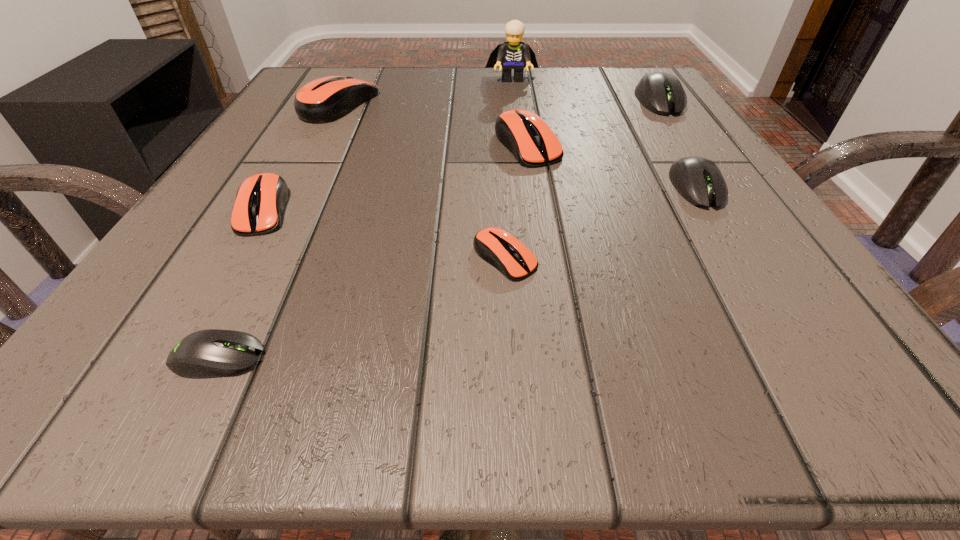
Find the location of a particular element. The width and height of the screenshot is (960, 540). Lego is located at coordinates (514, 54).

The height and width of the screenshot is (540, 960). Find the location of `the tallest object`. the tallest object is located at coordinates [514, 54].

Find the location of `the biggest orange computer mouse`. the biggest orange computer mouse is located at coordinates (324, 100).

Identify the location of the biggest gray computer mouse. The image size is (960, 540). (661, 93).

In order to click on the second biggest orange computer mouse in this screenshot , I will do [x=526, y=135].

This screenshot has height=540, width=960. Identify the location of the second biggest gray computer mouse. (698, 180).

Where is `the second smallest orange computer mouse`? the second smallest orange computer mouse is located at coordinates (260, 200).

This screenshot has height=540, width=960. What are the coordinates of `the nearest computer mouse` in the screenshot? It's located at (212, 353).

Identify the location of the smallest gray computer mouse. (212, 353).

You are a GUI agent. You are given a task and a screenshot of the screen. Output one action in this format:
    pyautogui.click(x=<x>, y=<y>)
    Task: Click on the smallest orange computer mouse
    Image resolution: width=960 pixels, height=540 pixels.
    Given the screenshot: What is the action you would take?
    pyautogui.click(x=502, y=250)